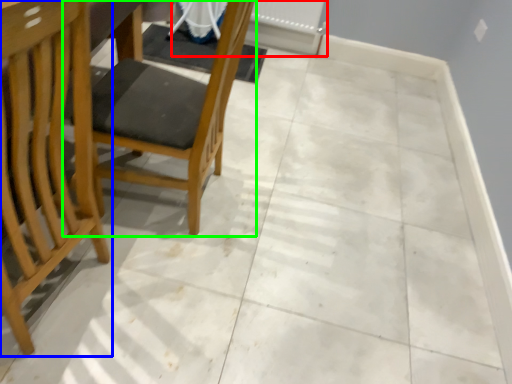
Question: Considering the real-world distances, which object is closest to radiator (highlighted by a red box)? chair (highlighted by a blue box) or chair (highlighted by a green box).

Choices:
 (A) chair
 (B) chair

Answer: (B)